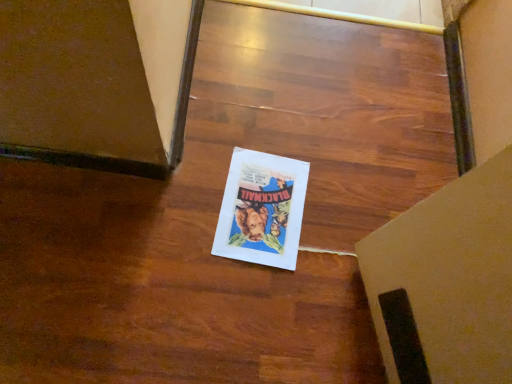
Image resolution: width=512 pixels, height=384 pixels. I want to click on matte paper poster at center, so click(x=262, y=209).

The width and height of the screenshot is (512, 384). What do you see at coordinates (262, 209) in the screenshot?
I see `matte paper poster at center` at bounding box center [262, 209].

You are a GUI agent. You are given a task and a screenshot of the screen. Output one action in this format:
    pyautogui.click(x=<x>, y=<y>)
    Task: Click on the matte paper poster at center
    
    Given the screenshot: What is the action you would take?
    pyautogui.click(x=262, y=209)